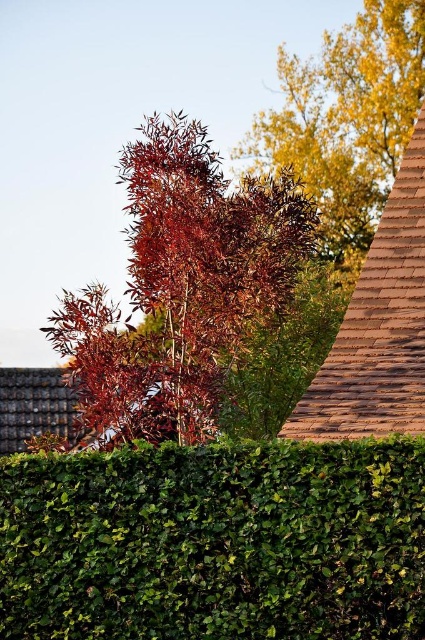
Who is shorter, green leafy hedge at center or glossy red autumn tree at center?

glossy red autumn tree at center

Is point (317, 445) farther from camera compared to point (172, 314)?

That is False.

Between point (226, 515) and point (269, 280), which one is positioned in front?

Point (226, 515) is in front.

Image resolution: width=425 pixels, height=640 pixels. I want to click on green leafy hedge at center, so click(215, 541).

Is point (142, 275) positioned before point (295, 100)?

Yes.

Can you confirm if glossy red autumn tree at center is shorter than golden yellow leaves at upper right?

Yes, glossy red autumn tree at center is shorter than golden yellow leaves at upper right.

Is point (308, 250) closer to viewer compared to point (393, 3)?

Yes, it is.

Where is `glossy red autumn tree at center`? The image size is (425, 640). glossy red autumn tree at center is located at coordinates (181, 285).

Who is taller, green leafy hedge at center or golden yellow leaves at upper right?

Standing taller between the two is green leafy hedge at center.

Find the location of a particular element. This screenshot has height=640, width=425. green leafy hedge at center is located at coordinates (215, 541).